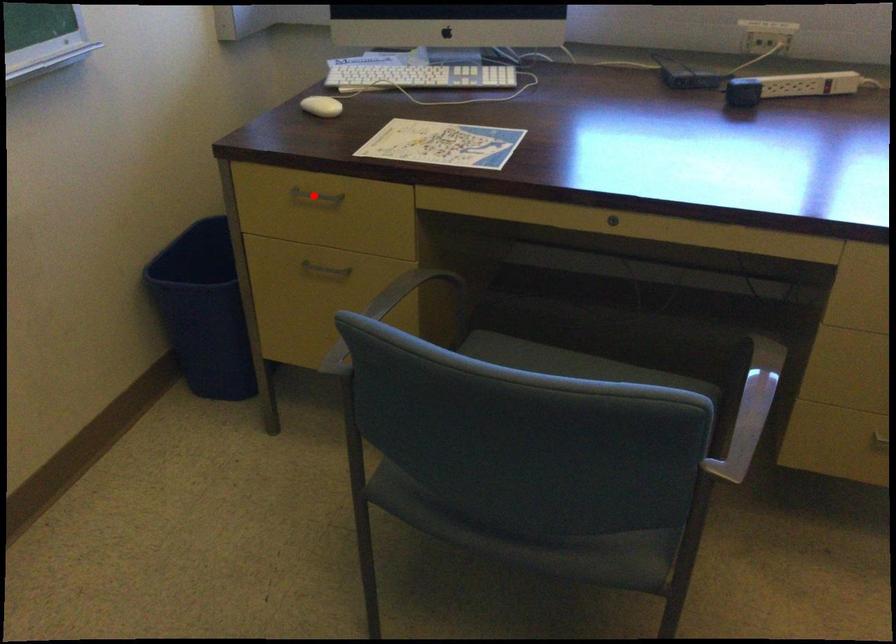
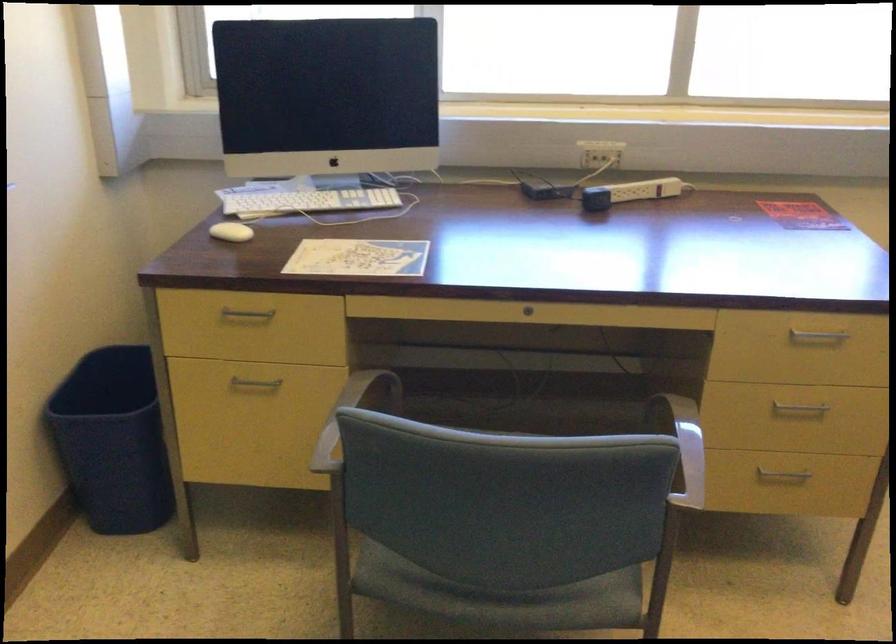
Where in the second image is the point corresponding to the highlighted location from the first image?

(247, 313)